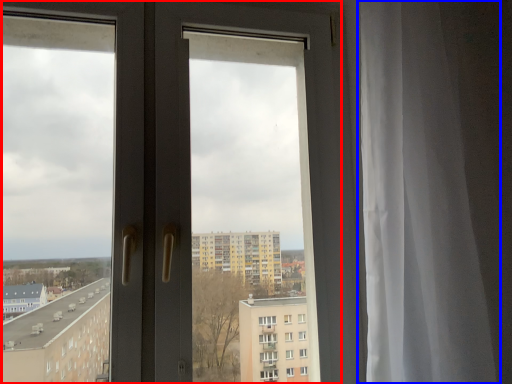
Question: Which object is closer to the camera taking this photo, door (highlighted by a red box) or curtain (highlighted by a blue box)?

Choices:
 (A) door
 (B) curtain

Answer: (B)